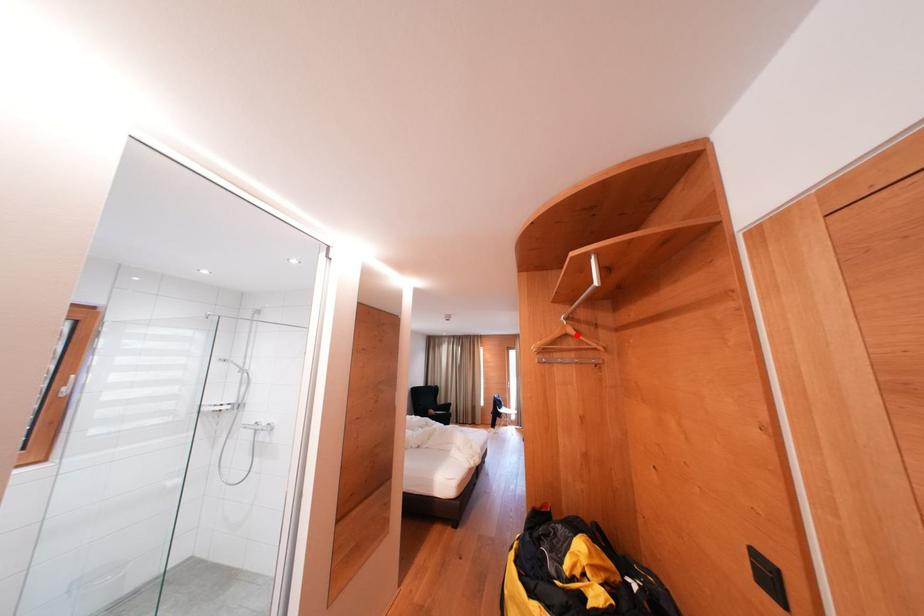
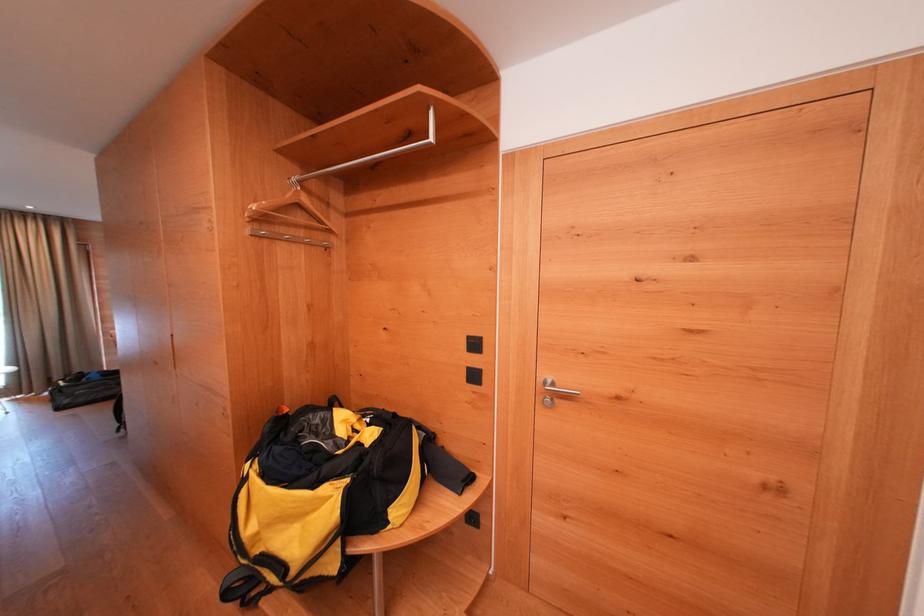
In the second image, find the point that corresponds to the highlighted location in the first image.

(312, 205)